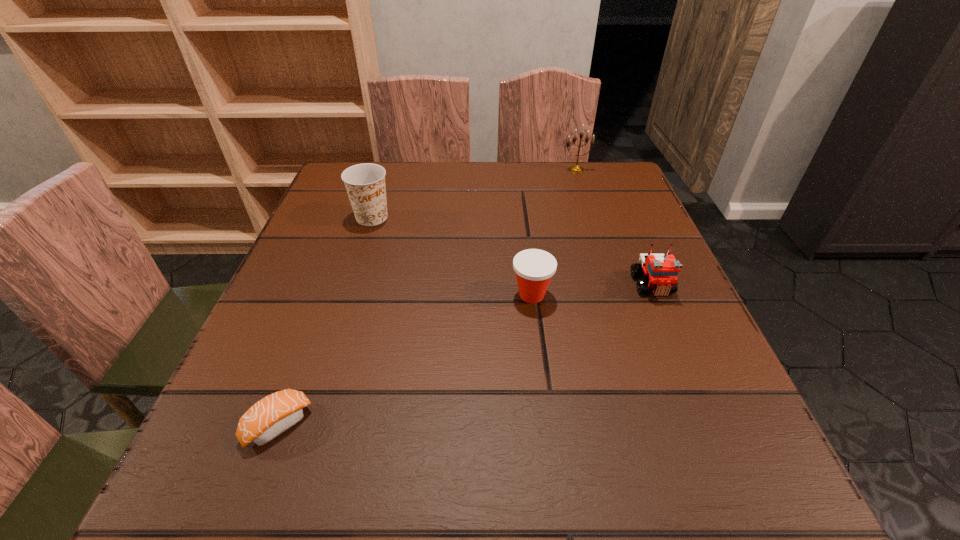
Identify the location of Lego at the right edge. The height and width of the screenshot is (540, 960). (661, 271).

Locate an element on the screen. object present at the far left corner is located at coordinates (365, 183).

Identify the location of object positioned at the near left corner. (271, 416).

Image resolution: width=960 pixels, height=540 pixels. I want to click on object present at the far right corner, so click(x=575, y=168).

Where is `vacant point at the far edge`? vacant point at the far edge is located at coordinates (410, 183).

In the image, there is a desktop. What are the coordinates of `free space at the near edge` in the screenshot? It's located at (467, 507).

Locate an element on the screen. This screenshot has width=960, height=540. vacant space at the left edge is located at coordinates (307, 363).

Image resolution: width=960 pixels, height=540 pixels. In the image, there is a desktop. In order to click on vacant region at the right edge in this screenshot , I will do `click(619, 251)`.

In the image, there is a desktop. What are the coordinates of `vacant space at the far left corner` in the screenshot? It's located at (342, 208).

In order to click on free space at the near right corner of the desktop in this screenshot , I will do `click(722, 483)`.